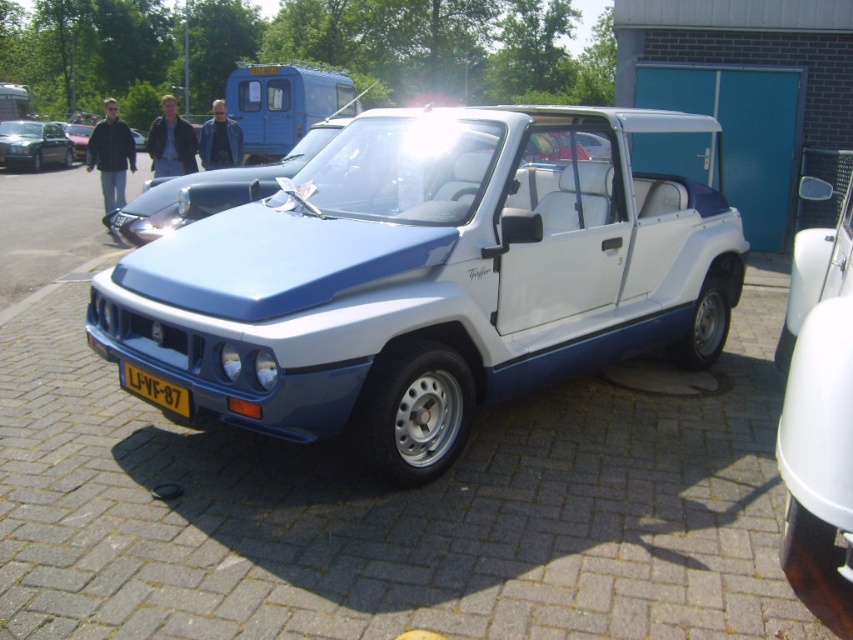
In the scene shown: You are standing at the point marked as point (431, 276) in the image. What object are you currently standing on?

You are standing on the blue metallic car at center.

You are standing in front of the vintage car and want to take a photo. You notice two points marked on the car, one at point (62, 147) and another at point (144, 387). Which point will appear closer to the camera in your photo?

Point (62, 147) is further to the camera than point (144, 387), so in the photo, point (62, 147) will appear closer to the camera.